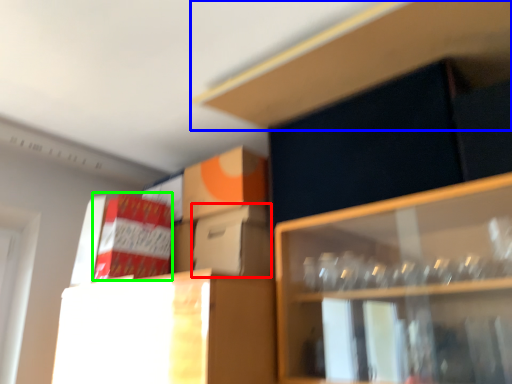
Question: Which is farther away from cardboard box (highlighted by a red box)? cabinet (highlighted by a blue box) or cardboard box (highlighted by a green box)?

Choices:
 (A) cabinet
 (B) cardboard box

Answer: (A)